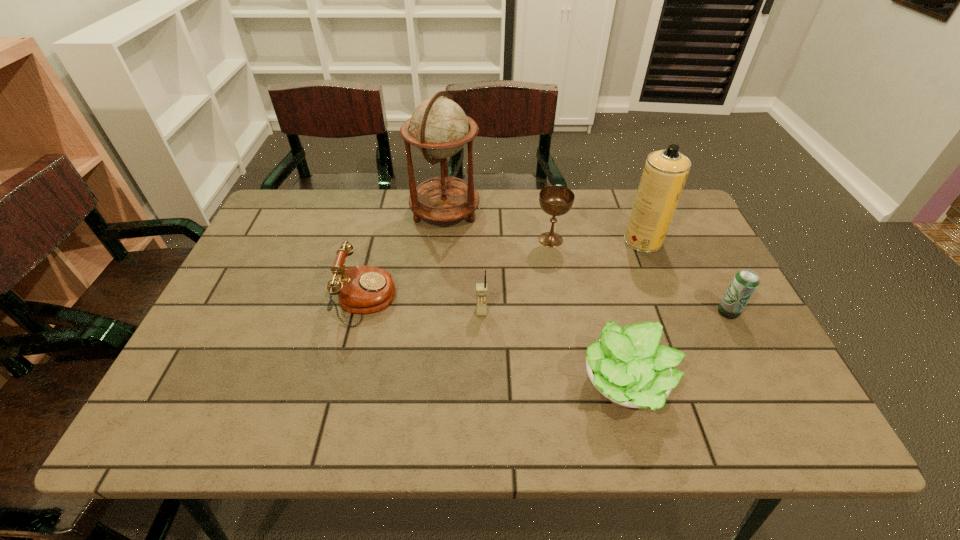
This screenshot has height=540, width=960. Identify the location of free space located 0.330m on the front of the aerosol can. (686, 350).

Locate an element on the screen. The height and width of the screenshot is (540, 960). free space located on the right of the chalice is located at coordinates (687, 240).

Identify the location of free location located on the front of the cellular telephone, where the keypad is located. The image size is (960, 540). (482, 361).

This screenshot has width=960, height=540. I want to click on vacant space located on the dial of the telephone, so click(x=482, y=300).

The width and height of the screenshot is (960, 540). Identify the location of free space located on the left of the beer can. (x=604, y=312).

The image size is (960, 540). What are the coordinates of `free space located on the left of the lettuce` in the screenshot? It's located at (557, 387).

Find the location of a particular element. globe that is positioned at the far edge is located at coordinates (439, 128).

The image size is (960, 540). Identify the location of aerosol can situated at the far edge. (665, 172).

Find the location of a particular element. The height and width of the screenshot is (540, 960). chalice that is at the far edge is located at coordinates (555, 200).

Locate an element on the screen. object present at the near edge is located at coordinates (627, 366).